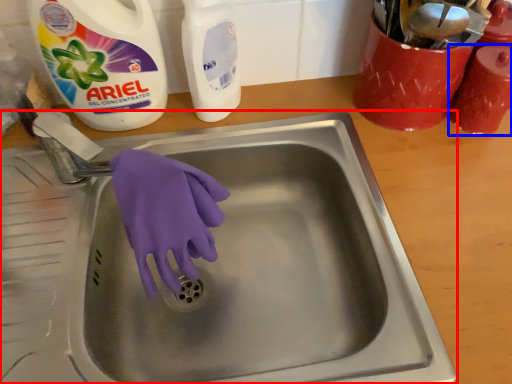
Question: Among these objects, which one is nearest to the camera, sink (highlighted by a red box) or cleaning product (highlighted by a blue box)?

Choices:
 (A) sink
 (B) cleaning product

Answer: (A)